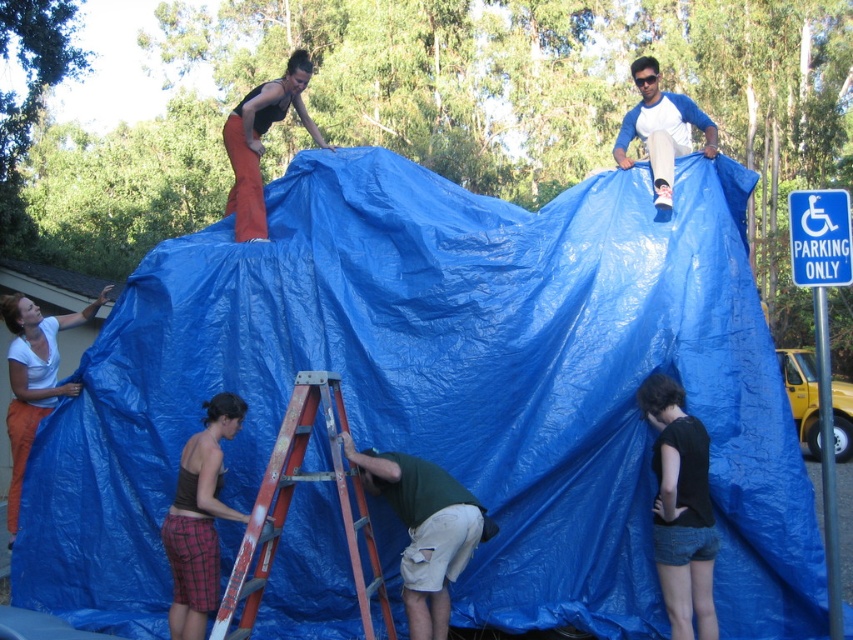
Question: Which is farther from the rusty metal ladder at center?

Choices:
 (A) green fabric at center
 (B) matte orange pants at upper left
 (C) blue baseball shirt at upper right

Answer: (C)

Question: Which of these objects is positioned farthest from the matte white shirt at lower left?

Choices:
 (A) blue baseball shirt at upper right
 (B) matte orange pants at upper left
 (C) green fabric at center
 (D) rusty metal ladder at center

Answer: (A)

Question: From the image, what is the correct spatial relationship of black cotton shirt at lower right in relation to plaid shorts at lower left?

Choices:
 (A) above
 (B) below

Answer: (A)

Question: Can you confirm if plaid shorts at lower left is positioned to the left of matte orange pants at upper left?

Choices:
 (A) yes
 (B) no

Answer: (B)

Question: From the image, what is the correct spatial relationship of matte orange pants at upper left in relation to blue baseball shirt at upper right?

Choices:
 (A) below
 (B) above

Answer: (B)

Question: Which is farther from the matte orange pants at upper left?

Choices:
 (A) rusty metal ladder at center
 (B) black cotton shirt at lower right
 (C) matte white shirt at lower left
 (D) green fabric at center

Answer: (B)